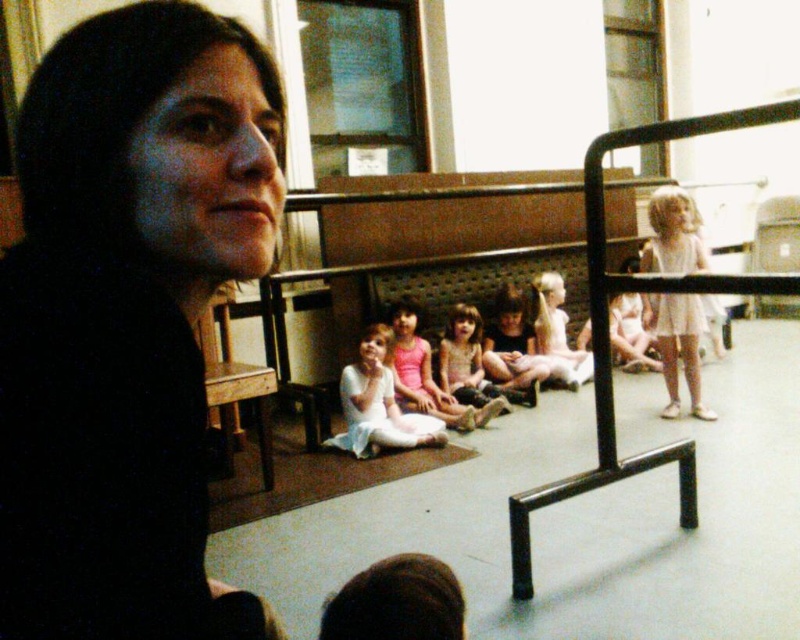
You are a photographer standing in the dance studio. You want to take a photo of the white cotton dress at right and the pink fabric dress at center. If your camera can capture objects within a 4 feet range, will both dresses fit in the photo?

The distance between the white cotton dress at right and the pink fabric dress at center is 3.74 feet, which is within the 4 feet range of the camera. Therefore, both dresses will fit in the photo.

You are a photographer setting up for a photoshoot in the dance studio. You need to position a light source so that it illuminates both the white cotton dress at right and the smooth white dress at center without casting harsh shadows. Considering their positions, which dress should be closer to the light source to achieve even lighting?

The white cotton dress at right is in front of the smooth white dress at center, so positioning the light source closer to the white cotton dress at right will help ensure both receive even illumination since it is nearer to the light.

Where is the smooth white dress at center located in the image?

The smooth white dress at center is located at point coordinates of approximately 0.569 on the x axis and 0.584 on the y axis.